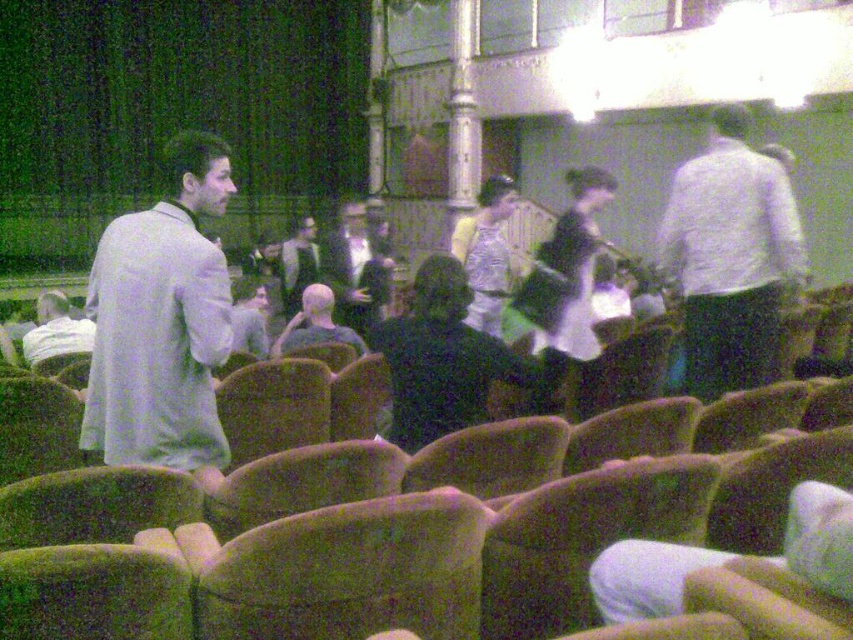
Does light gray fabric jacket at left have a lesser width compared to dark gray suit at center?

Incorrect, light gray fabric jacket at left's width is not less than dark gray suit at center's.

Is point (154, 422) more distant than point (293, 280)?

No, it is not.

Which is in front, point (125, 307) or point (317, 256)?

Point (125, 307) is more forward.

This screenshot has height=640, width=853. In order to click on light gray fabric jacket at left in this screenshot , I will do `click(161, 321)`.

Is point (683, 292) more distant than point (346, 243)?

No, it is in front of (346, 243).

Does white matte shirt at right appear on the left side of matte black jacket at center?

In fact, white matte shirt at right is to the right of matte black jacket at center.

At what (x,y) coordinates should I click in order to perform the action: click on white matte shirt at right. Please return your answer as a coordinate pair (x, y). The width and height of the screenshot is (853, 640). Looking at the image, I should click on (729, 257).

Can you confirm if black matte jacket at center is thinner than matte black jacket at center?

In fact, black matte jacket at center might be wider than matte black jacket at center.

Find the location of `black matte jacket at center`. black matte jacket at center is located at coordinates point(442,358).

At what (x,y) coordinates should I click in order to perform the action: click on black matte jacket at center. Please return your answer as a coordinate pair (x, y). This screenshot has width=853, height=640. Looking at the image, I should click on (442, 358).